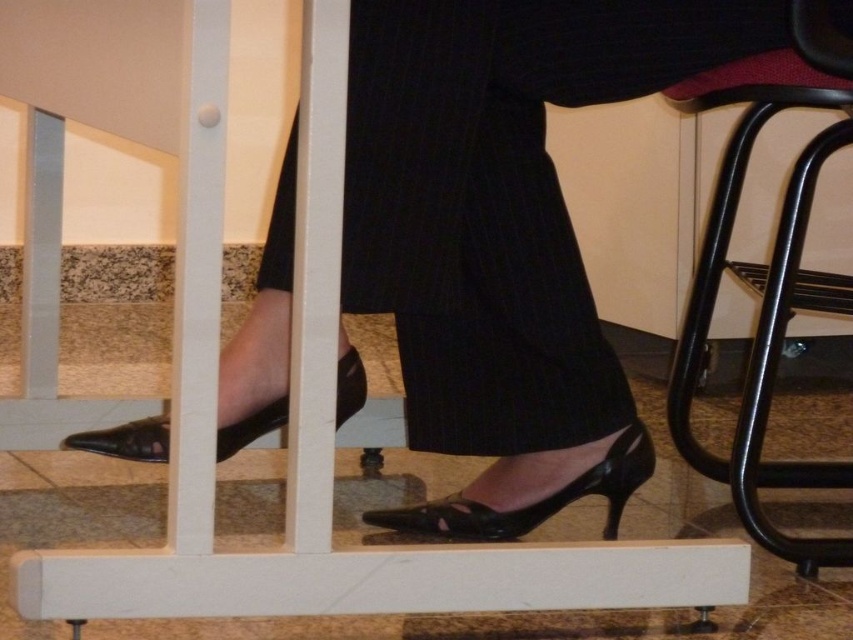
Is black pinstripe skirt at center above black metal chair at right?

Indeed, black pinstripe skirt at center is positioned over black metal chair at right.

Is black pinstripe skirt at center behind black metal chair at right?

That is False.

You are a GUI agent. You are given a task and a screenshot of the screen. Output one action in this format:
    pyautogui.click(x=<x>, y=<y>)
    Task: Click on the black pinstripe skirt at center
    
    Given the screenshot: What is the action you would take?
    tap(500, 198)

Consider the image. Does black metal chair at right have a lesser height compared to black leather shoe at center?

Incorrect, black metal chair at right's height does not fall short of black leather shoe at center's.

Between black metal chair at right and black leather shoe at center, which one has more height?

black metal chair at right

Who is more distant from viewer, (808, 49) or (479, 528)?

The point (479, 528) is behind.

You are a GUI agent. You are given a task and a screenshot of the screen. Output one action in this format:
    pyautogui.click(x=<x>, y=<y>)
    Task: Click on the black metal chair at right
    Image resolution: width=853 pixels, height=640 pixels.
    Given the screenshot: What is the action you would take?
    pyautogui.click(x=767, y=268)

Does black leather shoe at center appear on the right side of black leather shoe at lower left?

Yes, black leather shoe at center is to the right of black leather shoe at lower left.

Locate an element on the screen. Image resolution: width=853 pixels, height=640 pixels. black leather shoe at center is located at coordinates (532, 502).

You are a GUI agent. You are given a task and a screenshot of the screen. Output one action in this format:
    pyautogui.click(x=<x>, y=<y>)
    Task: Click on the black leather shoe at center
    The width and height of the screenshot is (853, 640).
    Given the screenshot: What is the action you would take?
    pyautogui.click(x=532, y=502)